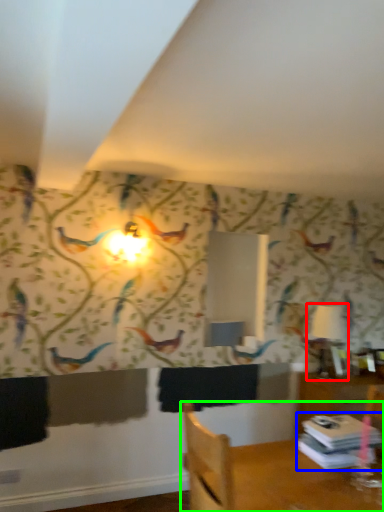
Question: Which object is positioned farthest from table lamp (highlighted by a red box)? Select from book (highlighted by a blue box) and furniture (highlighted by a green box).

Choices:
 (A) book
 (B) furniture

Answer: (B)